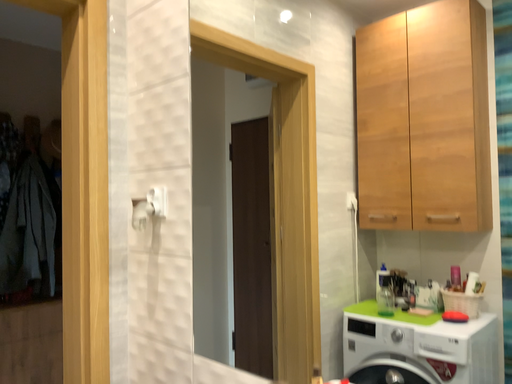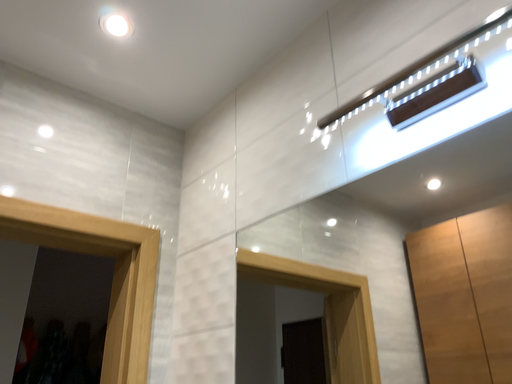
Question: Which way did the camera rotate in the video?

Choices:
 (A) rotated downward
 (B) rotated upward

Answer: (B)